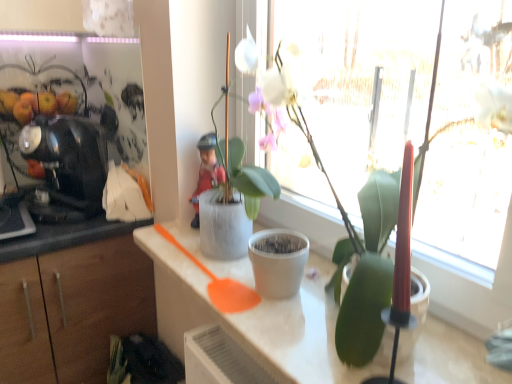
Locate an element on the screen. The width and height of the screenshot is (512, 384). vacant region in front of white matte flowerpot at center is located at coordinates (289, 329).